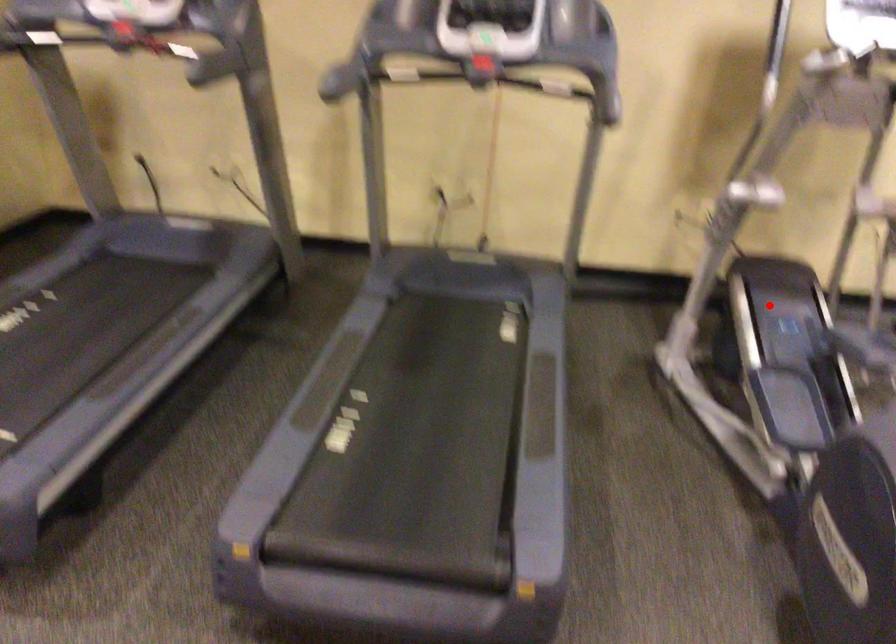
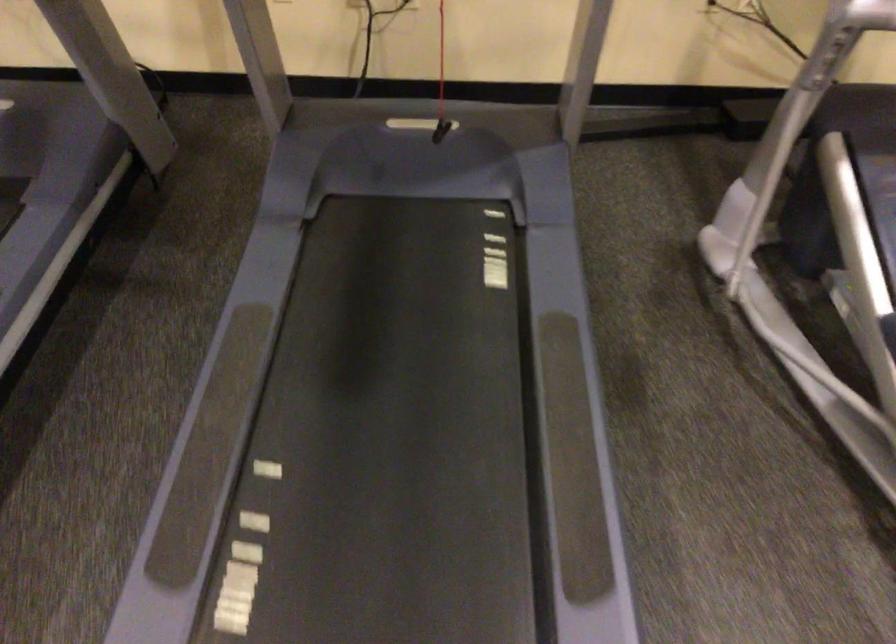
Question: I am providing you with two images of the same scene from different viewpoints. Given a red point in image1, look at the same physical point in image2. Is it:

Choices:
 (A) Closer to the viewpoint
 (B) Farther from the viewpoint

Answer: (A)